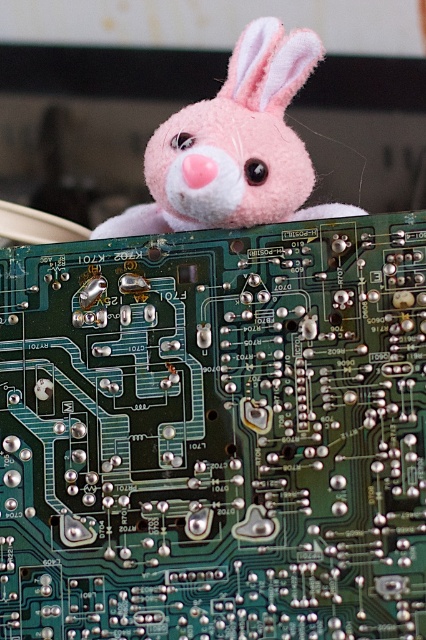
You are holding a small flashlight and want to shine it directly on the point at coordinate [314,252]. Given that the flashlight has a maximum range of 25 inches, will you need to move closer to reach the point?

The point at coordinate [314,252] is 27.46 inches away from the viewer. Since the flashlight has a maximum range of 25 inches, you will need to move closer to reach the point.

You are an engineer working on a project and need to access the green printed circuit board at center. However, there is a pink plush toy at upper center in the way. Can you move the plush toy to the side to access the PCB?

The pink plush toy at upper center is behind the green printed circuit board at center, so you can access the PCB without moving the plush toy because it is already positioned in front of it.